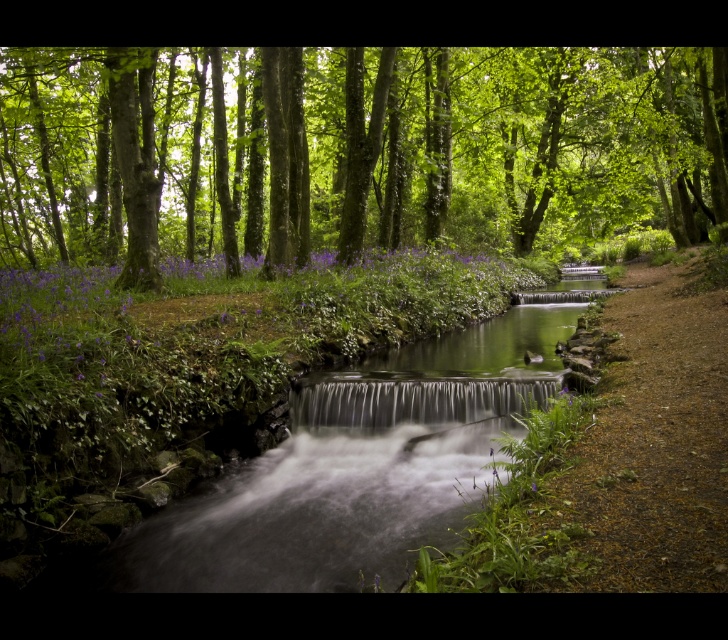
From the picture: You are a photographer planning to take a photo of the green leafy tree at center and the clear glass waterfall at center. Which object should you focus on first if you want to capture both in sharp detail?

Result: The green leafy tree at center is larger in size than the clear glass waterfall at center, so you should focus on the green leafy tree at center first to ensure both are in sharp detail.

You are a hiker standing in the forest and want to take a photo of the clear glass waterfall at center without the green leafy tree at center blocking the view. What should you do?

The green leafy tree at center is closer to you than the clear glass waterfall at center. To avoid the tree blocking the view, you should move to a position where the tree is no longer between you and the waterfall, such as moving sideways or further back to get a clear line of sight.

You are standing in the forest scene and want to take a photo of the green leafy tree at center. If you move 0.1 units to the right along the x axis, will the tree still be in the frame?

The green leafy tree at center is located at point (355, 150). Moving 0.1 units to the right along the x axis would place the camera at position (355, 214). Since the tree is at 0.236 on the x axis, it would still be within the frame as the camera moves right, so yes, the tree would remain in the frame.